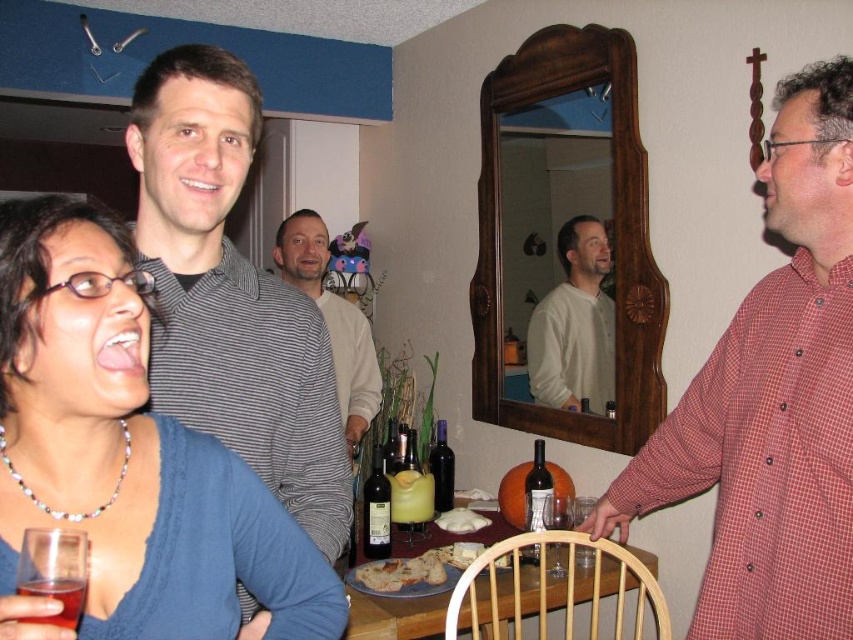
Question: Can you confirm if transparent plastic wine glass at lower left is thinner than translucent plastic cup at lower left?

Choices:
 (A) no
 (B) yes

Answer: (A)

Question: Can you confirm if transparent plastic wine glass at lower left is smaller than golden brown bread at table center?

Choices:
 (A) yes
 (B) no

Answer: (A)

Question: Is translucent plastic cup at lower left positioned behind dark glass bottle at table?

Choices:
 (A) yes
 (B) no

Answer: (B)

Question: Among these points, which one is nearest to the camera?

Choices:
 (A) (80, 609)
 (B) (561, 234)

Answer: (A)

Question: Which point is closer to the camera?

Choices:
 (A) dark glass bottle at table
 (B) striped shirt at center
 (C) clear glass wine glass at table center

Answer: (C)

Question: Which of the following is the closest to the observer?

Choices:
 (A) (405, 593)
 (B) (560, 307)

Answer: (A)